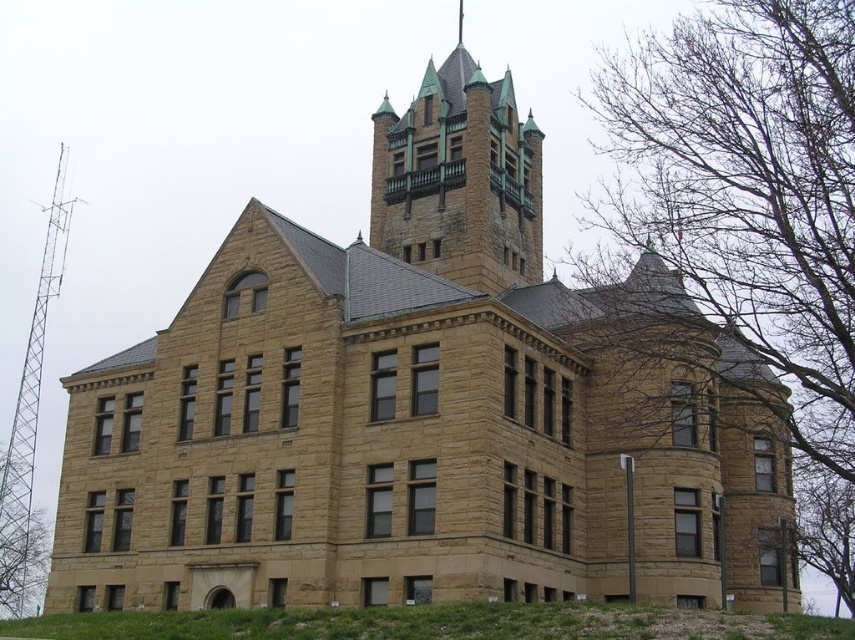
Can you confirm if bare branches at right is positioned to the left of green copper spires at upper center?

In fact, bare branches at right is to the right of green copper spires at upper center.

Consider the image. Does bare branches at right have a greater width compared to green copper spires at upper center?

Yes, bare branches at right is wider than green copper spires at upper center.

Is point (762, 300) closer to viewer compared to point (382, 154)?

That is True.

Where is `bare branches at right`? Image resolution: width=855 pixels, height=640 pixels. bare branches at right is located at coordinates (746, 188).